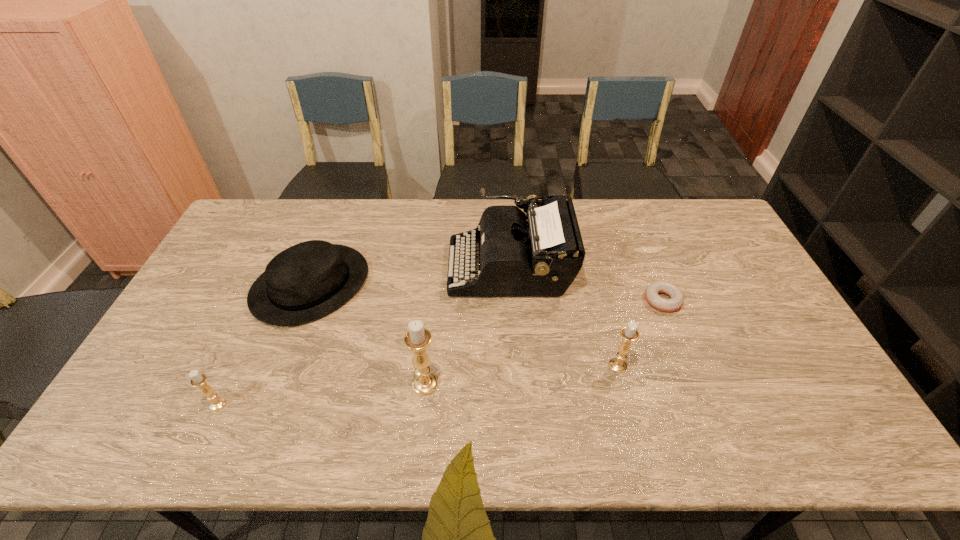
This screenshot has width=960, height=540. What are the coordinates of `vacant space situated on the right of the nearest candle holder` in the screenshot? It's located at (376, 404).

Image resolution: width=960 pixels, height=540 pixels. I want to click on free space located 0.060m on the back of the tallest object, so click(x=428, y=354).

The height and width of the screenshot is (540, 960). Identify the location of free space located 0.210m on the right of the fourth shortest object. (707, 366).

Where is `vacant space located 0.140m on the front of the second shortest object`? vacant space located 0.140m on the front of the second shortest object is located at coordinates (278, 372).

Where is `vacant region located on the left of the rightmost object`? The width and height of the screenshot is (960, 540). vacant region located on the left of the rightmost object is located at coordinates (531, 300).

What are the coordinates of `vacant area located 0.160m on the typing side of the typewriter` in the screenshot? It's located at (400, 267).

Where is `free spot located 0.120m on the typing side of the typewriter`? The image size is (960, 540). free spot located 0.120m on the typing side of the typewriter is located at coordinates (412, 267).

This screenshot has height=540, width=960. I want to click on free space located on the typing side of the typewriter, so click(x=421, y=267).

Identify the location of object situated at the far edge. Image resolution: width=960 pixels, height=540 pixels. (540, 253).

Locate an element on the screen. This screenshot has width=960, height=540. blank space at the far edge of the desktop is located at coordinates (489, 202).